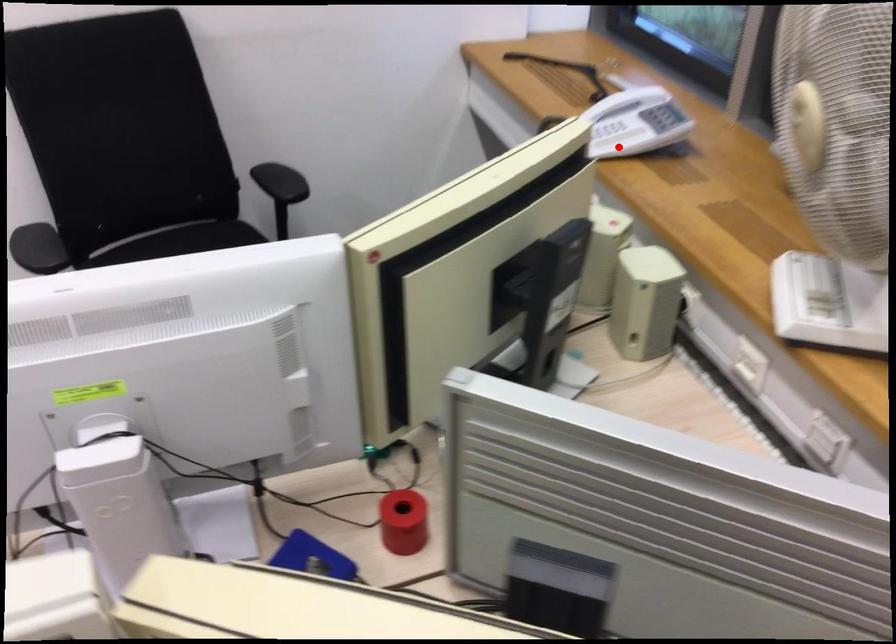
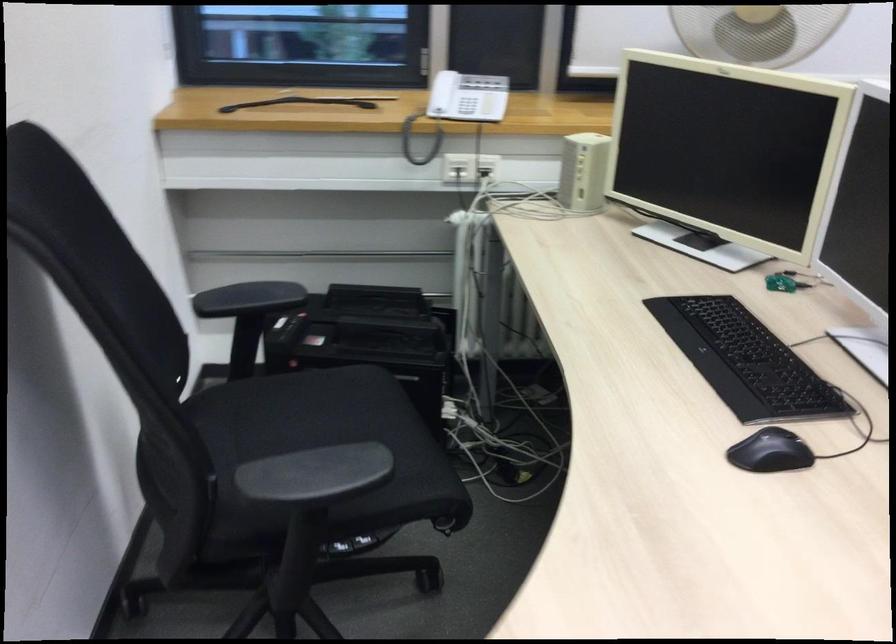
Question: I am providing you with two images of the same scene from different viewpoints. A red point is shown in image1. For the corresponding object point in image2, is it positioned nearer or farther from the camera?

Choices:
 (A) Nearer
 (B) Farther

Answer: (B)